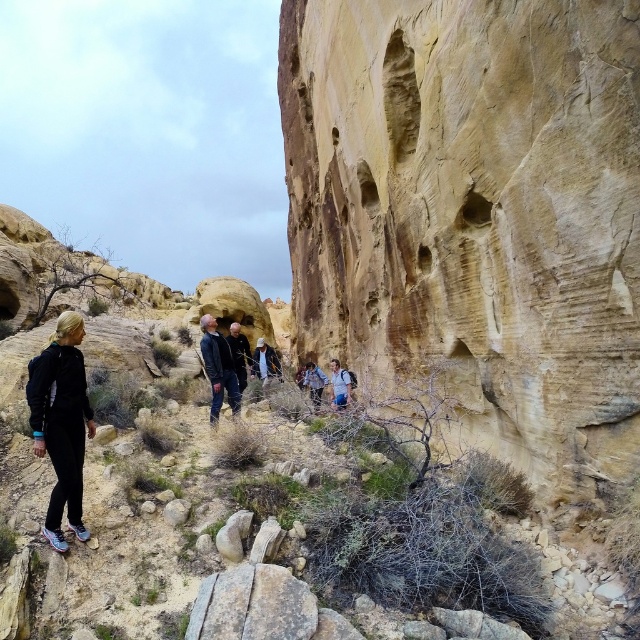
Question: Which object appears farthest from the camera in this image?

Choices:
 (A) light brown leather jacket at center
 (B) dark blue jacket at center
 (C) dark gray jacket at center
 (D) light blue denim jacket at center

Answer: (A)

Question: In this image, where is black matte pants at left located relative to dark blue jacket at center?

Choices:
 (A) right
 (B) left

Answer: (B)

Question: In this image, where is yellow sandstone rock face at center located relative to blue denim jacket at center?

Choices:
 (A) left
 (B) right

Answer: (B)

Question: Can you confirm if black matte pants at left is wider than light brown leather jacket at center?

Choices:
 (A) no
 (B) yes

Answer: (B)

Question: Which of the following is the farthest from the observer?

Choices:
 (A) (348, 385)
 (B) (280, 381)
 (C) (240, 401)
 (D) (317, 365)

Answer: (D)

Question: Which point appears closest to the camera in this image?

Choices:
 (A) (x=275, y=356)
 (B) (x=636, y=42)
 (C) (x=214, y=403)

Answer: (B)